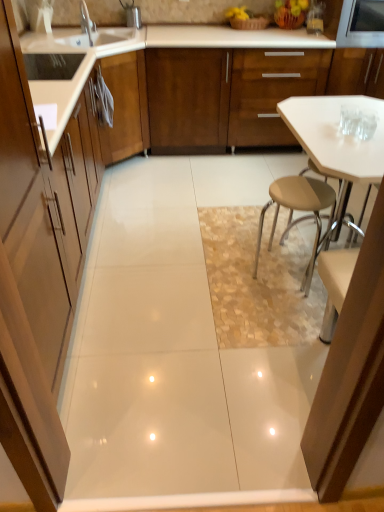
Question: Considering the relative positions of metallic stainless steel microwave at upper right and matte wood cabinet at left, which ranks as the 1th cabinetry in left-to-right order, in the image provided, is metallic stainless steel microwave at upper right to the left or to the right of matte wood cabinet at left, which ranks as the 1th cabinetry in left-to-right order,?

Choices:
 (A) left
 (B) right

Answer: (B)

Question: Is point (337, 47) closer or farther from the camera than point (8, 58)?

Choices:
 (A) closer
 (B) farther

Answer: (B)

Question: Which of these objects is positioned closest to the white glossy table at center?

Choices:
 (A) silver metallic faucet at upper left
 (B) metallic stainless steel microwave at upper right
 (C) matte wood cabinet at left, which is counted as the first cabinetry, starting from the bottom
 (D) wooden cabinet at center, the 1th cabinetry in the top-to-bottom sequence

Answer: (D)

Question: Considering the real-world distances, which object is closest to the silver metallic faucet at upper left?

Choices:
 (A) matte wood cabinet at left, the first cabinetry when ordered from front to back
 (B) metallic stainless steel microwave at upper right
 (C) wooden cabinet at center, positioned as the second cabinetry in bottom-to-top order
 (D) white glossy table at center

Answer: (C)